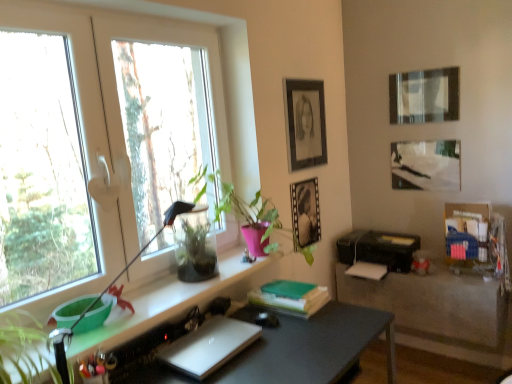
Find the location of a particular element. vacant region above sleek silver laptop at center (from a real-world perspective) is located at coordinates (206, 341).